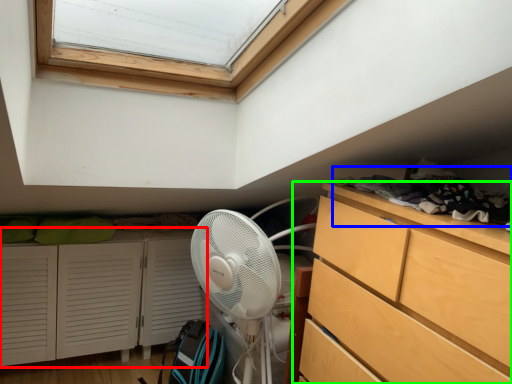
Question: Which object is the closest to the cupboard (highlighted by a red box)? Choose among these: laundry (highlighted by a blue box) or chest of drawers (highlighted by a green box).

Choices:
 (A) laundry
 (B) chest of drawers

Answer: (B)